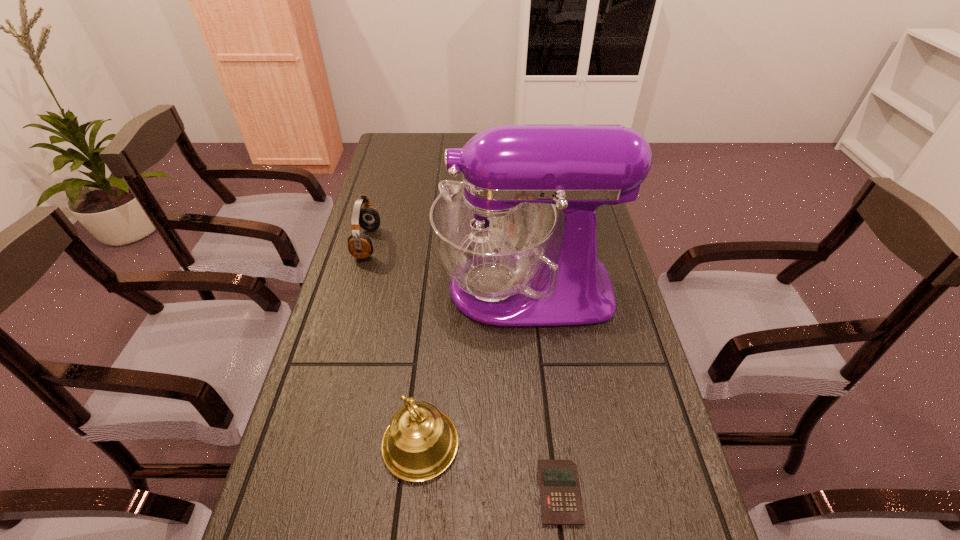
Identify the location of mixer. (512, 261).

Find the location of a particular element. This screenshot has height=540, width=960. the third shortest object is located at coordinates (421, 442).

What are the coordinates of `the leftmost object` in the screenshot? It's located at (360, 246).

The width and height of the screenshot is (960, 540). Identify the location of headset. (360, 246).

You are a GUI agent. You are given a task and a screenshot of the screen. Output one action in this format:
    pyautogui.click(x=<x>, y=<y>)
    Task: Click on the shortest object
    This screenshot has height=540, width=960.
    Given the screenshot: What is the action you would take?
    pyautogui.click(x=561, y=503)

This screenshot has width=960, height=540. In order to click on vacant space located at the bowl opening of the tallest object in this screenshot , I will do `click(415, 288)`.

The height and width of the screenshot is (540, 960). In order to click on vacant space located 0.260m at the bowl opening of the tallest object in this screenshot , I will do `click(341, 288)`.

You are a GUI agent. You are given a task and a screenshot of the screen. Output one action in this format:
    pyautogui.click(x=<x>, y=<y>)
    Task: Click on the vacant space located 0.150m at the bowl opening of the tallest object
    
    Given the screenshot: What is the action you would take?
    [x=381, y=288]

You are a GUI agent. You are given a task and a screenshot of the screen. Output one action in this format:
    pyautogui.click(x=<x>, y=<y>)
    Task: Click on the vacant position located on the right of the bell
    Image resolution: width=960 pixels, height=540 pixels.
    Given the screenshot: What is the action you would take?
    pyautogui.click(x=558, y=444)

You are a GUI agent. You are given a task and a screenshot of the screen. Output one action in this format:
    pyautogui.click(x=<x>, y=<y>)
    Task: Click on the blank area located 0.140m on the ear cups of the third tallest object
    This screenshot has height=540, width=960.
    Given the screenshot: What is the action you would take?
    pyautogui.click(x=425, y=243)